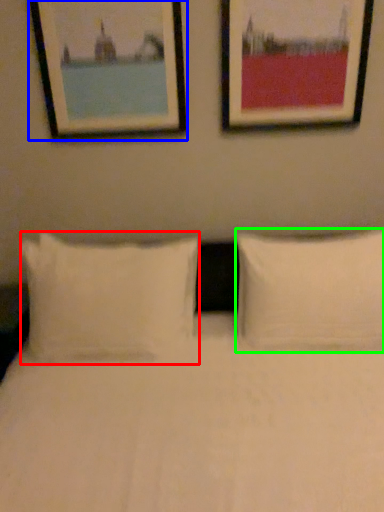
Question: Which is nearer to the pillow (highlighted by a red box)? picture frame (highlighted by a blue box) or pillow (highlighted by a green box).

Choices:
 (A) picture frame
 (B) pillow

Answer: (B)